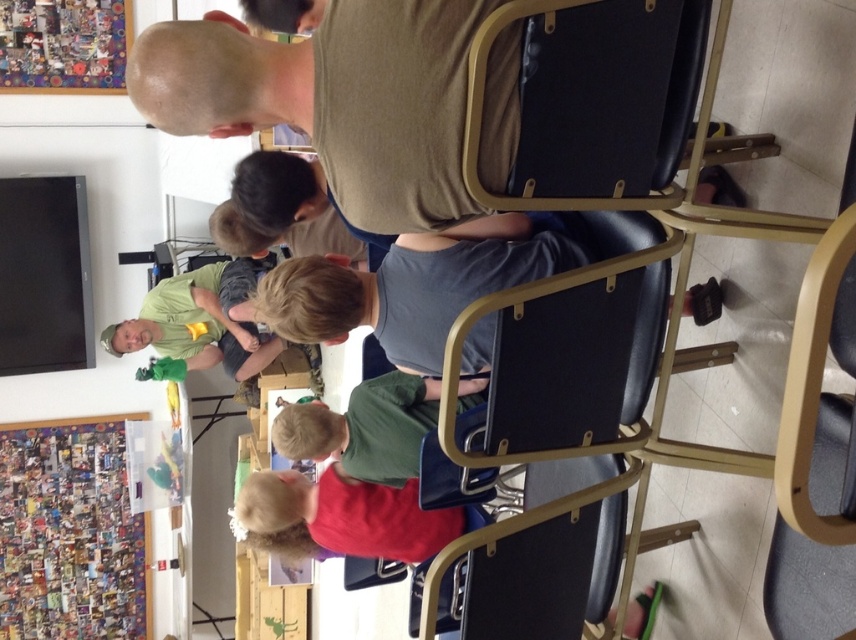
You are standing in the classroom and want to reach the point marked as point (391,268). If you can walk 10 feet per minute, how long will it take you to reach that point?

The distance between you and point (391,268) is 7.29 feet. At a walking speed of 10 feet per minute, it would take approximately 0.729 minutes, which is about 44 seconds, to reach the point.

In the scene shown: You are a photographer trying to capture both the gray matte shirt at center and the green fabric shirt at center in a single photo. Which shirt should you adjust your camera angle to focus on first to ensure both are in frame?

The gray matte shirt at center is thinner than the green fabric shirt at center, so you should focus on the thicker green fabric shirt at center first to ensure both are captured in the frame.